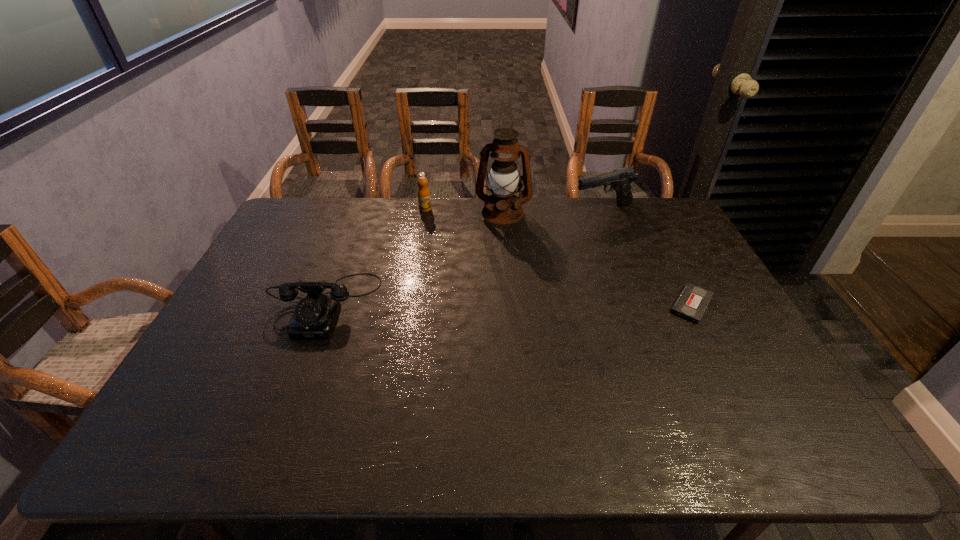
At what (x,y) coordinates should I click in order to perform the action: click on unoccupied position between the gun and the telephone. Please return your answer as a coordinate pair (x, y). Looking at the image, I should click on (465, 257).

The image size is (960, 540). I want to click on blank region between the leftmost object and the gun, so click(465, 257).

Identify the location of empty location between the orange juice and the third object from right to left. The image size is (960, 540). (464, 211).

In order to click on free space that is in between the third object from left to right and the fourth object from right to left in this screenshot , I will do `click(464, 211)`.

This screenshot has height=540, width=960. I want to click on vacant point located between the third object from left to right and the fourth tallest object, so click(414, 259).

The height and width of the screenshot is (540, 960). Identify the location of free space between the tallest object and the leftmost object. click(x=414, y=259).

Locate an element on the screen. The height and width of the screenshot is (540, 960). vacant area that lies between the shortest object and the gun is located at coordinates (647, 257).

Find the location of a particular element. The image size is (960, 540). empty location between the telephone and the gun is located at coordinates (465, 257).

You are a GUI agent. You are given a task and a screenshot of the screen. Output one action in this format:
    pyautogui.click(x=<x>, y=<y>)
    Task: Click on the object that can be found as the third closest to the videotape
    This screenshot has width=960, height=540.
    Given the screenshot: What is the action you would take?
    pyautogui.click(x=424, y=201)

Image resolution: width=960 pixels, height=540 pixels. Identify the location of object that stands as the fourth closest to the shortest object. (315, 315).